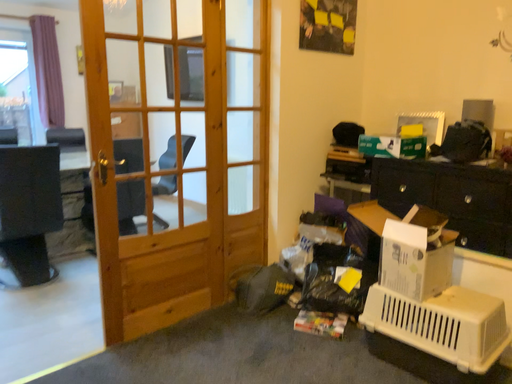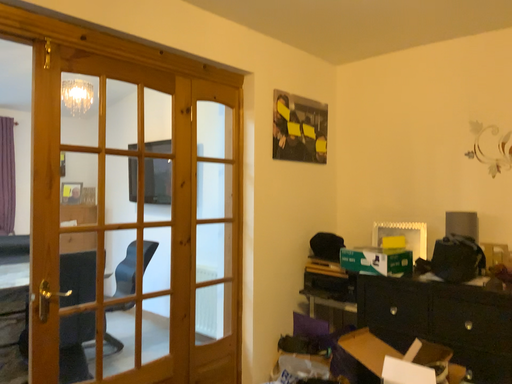
Question: Which way did the camera rotate in the video?

Choices:
 (A) rotated downward
 (B) rotated upward

Answer: (B)